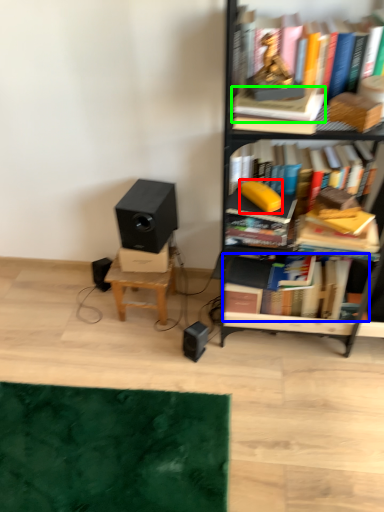
Question: Which object is the farthest from paperback book (highlighted by a red box)? Choose among these: book (highlighted by a blue box) or paperback book (highlighted by a green box).

Choices:
 (A) book
 (B) paperback book

Answer: (A)